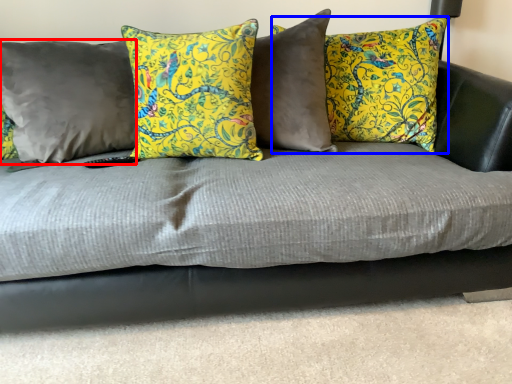
Question: Which point is further to the camera, pillow (highlighted by a red box) or pillow (highlighted by a blue box)?

Choices:
 (A) pillow
 (B) pillow

Answer: (B)